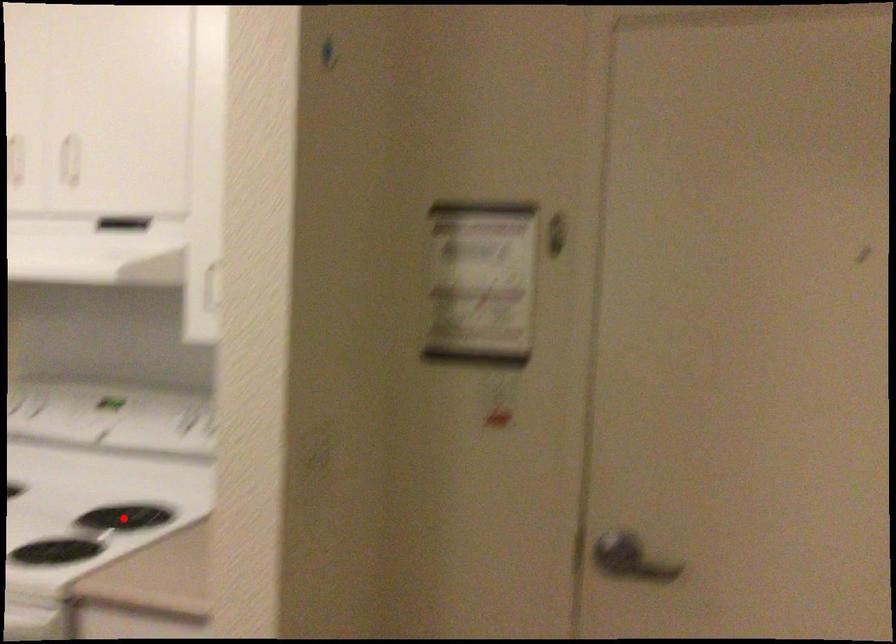
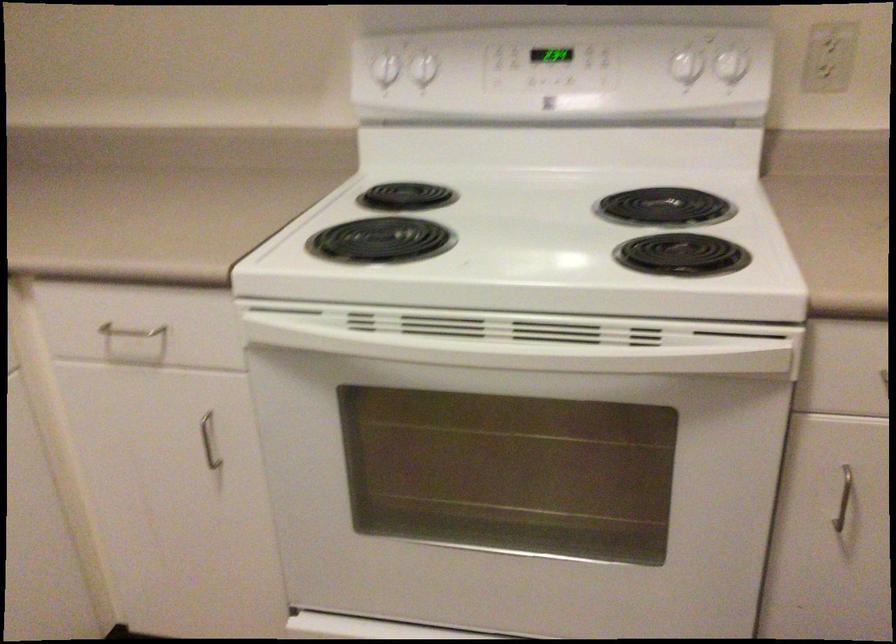
In the second image, find the point that corresponds to the highlighted location in the first image.

(664, 207)